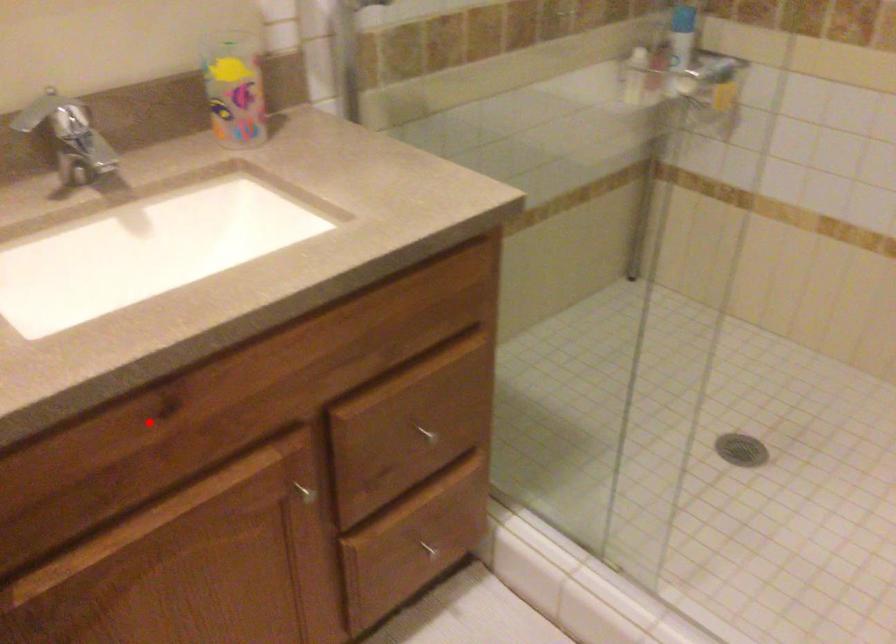
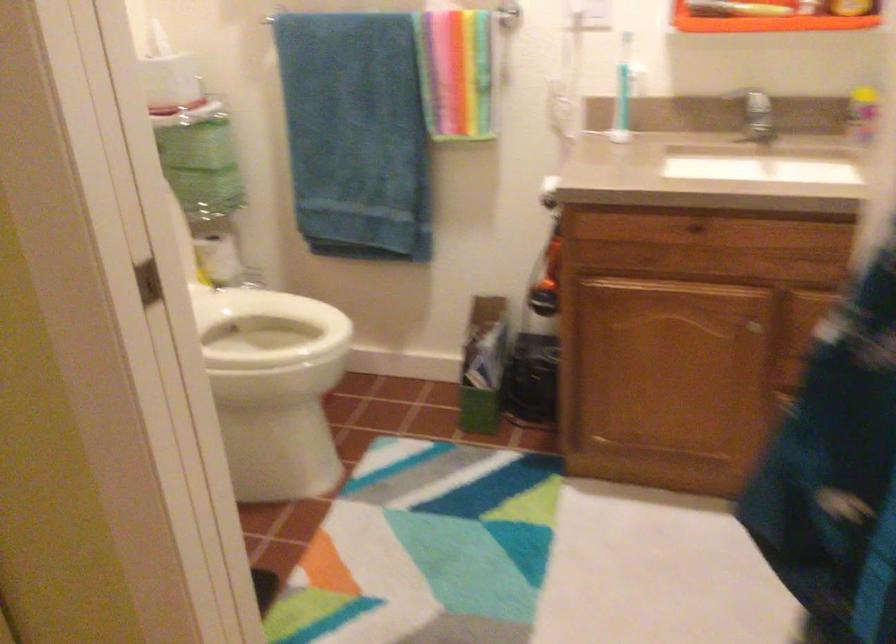
Locate, in the second image, the point that corresponds to the highlighted location in the first image.

(692, 229)